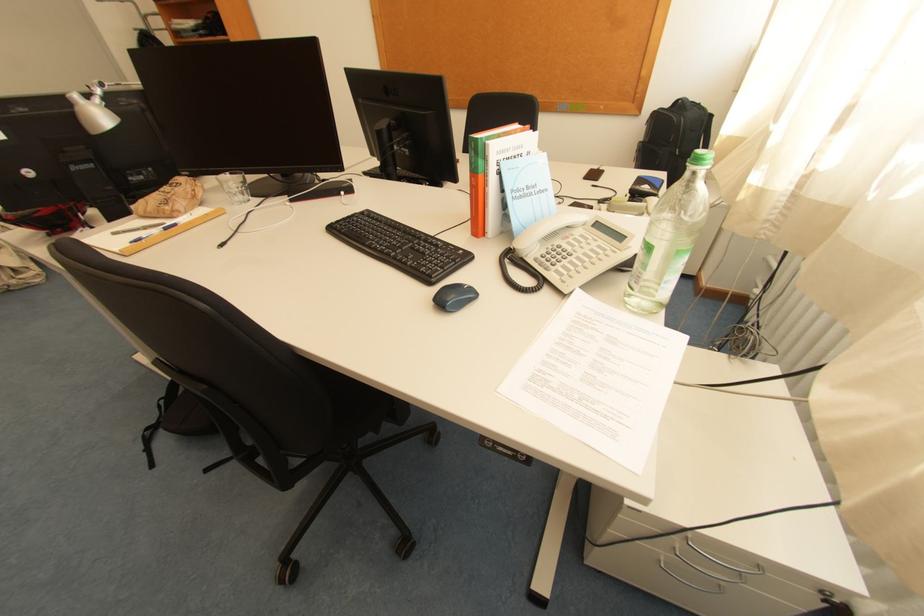
The image size is (924, 616). In order to click on blue computer mouse in this screenshot , I will do `click(455, 296)`.